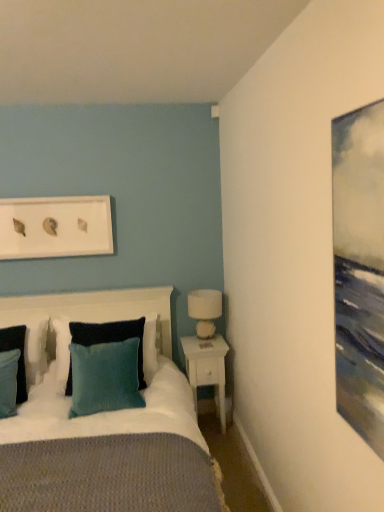
Question: Considering their positions, is white ceramic table lamp at right located in front of or behind teal fabric pillow at left, the second pillow positioned from the right?

Choices:
 (A) front
 (B) behind

Answer: (B)

Question: In the image, is white ceramic table lamp at right on the left side or the right side of teal fabric pillow at left, acting as the second pillow starting from the left?

Choices:
 (A) right
 (B) left

Answer: (A)

Question: Which of these objects is positioned farthest from the teal fabric pillow at left, the second pillow positioned from the right?

Choices:
 (A) velvet dark blue headboard at center
 (B) white matte picture frame at upper center
 (C) white ceramic table lamp at right
 (D) teal fabric pillow at left, which appears as the first pillow when viewed from the left
 (E) white wood nightstand at lower right

Answer: (C)

Question: Estimate the real-world distances between objects in this image. Which object is closer to the white matte picture frame at upper center?

Choices:
 (A) velvet dark blue headboard at center
 (B) teal velvet pillow at center, the first pillow in the right-to-left sequence
 (C) teal fabric pillow at left, the second pillow positioned from the right
 (D) teal fabric pillow at left, which appears as the first pillow when viewed from the left
 (E) white wood nightstand at lower right

Answer: (A)